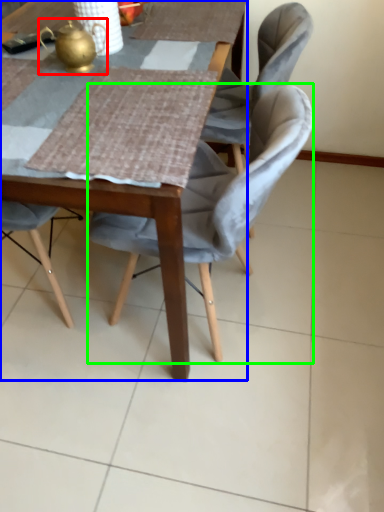
Question: Which object is positioned farthest from tea pot (highlighted by a red box)? Select from table (highlighted by a blue box) and chair (highlighted by a green box).

Choices:
 (A) table
 (B) chair

Answer: (A)